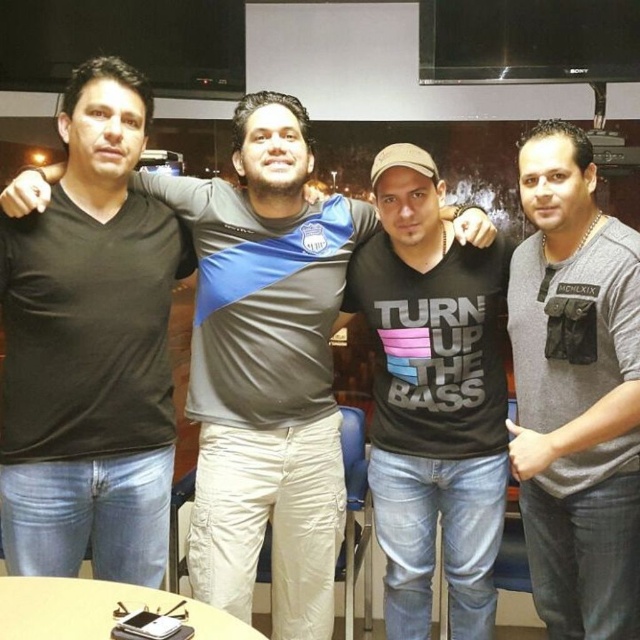
Question: Is black matte t-shirt at left bigger than black matte t-shirt at center?

Choices:
 (A) yes
 (B) no

Answer: (B)

Question: Which of the following is the closest to the observer?

Choices:
 (A) (259, 637)
 (B) (481, 416)

Answer: (A)

Question: Is black matte shirt at center wider than black matte t-shirt at center?

Choices:
 (A) no
 (B) yes

Answer: (B)

Question: Can you confirm if gray matte shirt at right is positioned above black matte t-shirt at center?

Choices:
 (A) yes
 (B) no

Answer: (A)

Question: Estimate the real-world distances between objects in this image. Which object is farther from the gray matte shirt at right?

Choices:
 (A) black matte t-shirt at left
 (B) black matte t-shirt at center

Answer: (A)

Question: Which point is farther to the camera?

Choices:
 (A) (200, 400)
 (B) (195, 605)

Answer: (A)